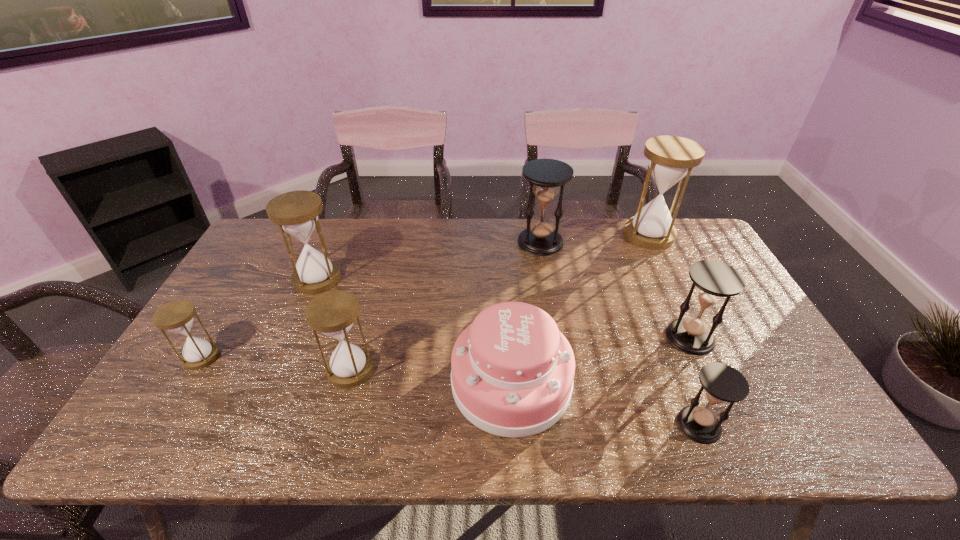
What are the coordinates of `the tallest hourglass` in the screenshot? It's located at click(671, 158).

Where is `the rightmost white hourglass`? the rightmost white hourglass is located at coordinates (671, 158).

Image resolution: width=960 pixels, height=540 pixels. Identify the location of the leftmost black hourglass. (545, 176).

I want to click on the farthest black hourglass, so click(545, 176).

Find the location of `the third farthest object`. the third farthest object is located at coordinates (296, 212).

I want to click on the second white hourglass from left to right, so click(x=296, y=212).

At what (x,y) coordinates should I click in order to perform the action: click on the second farthest black hourglass. Please return your answer as a coordinate pair (x, y). Looking at the image, I should click on [714, 280].

Image resolution: width=960 pixels, height=540 pixels. Find the location of `the third white hourglass from left to right`. the third white hourglass from left to right is located at coordinates (332, 313).

Find the location of a particular element. The height and width of the screenshot is (540, 960). the sixth object from right to left is located at coordinates (332, 313).

Image resolution: width=960 pixels, height=540 pixels. In order to click on pink birthday cake in this screenshot , I will do `click(512, 370)`.